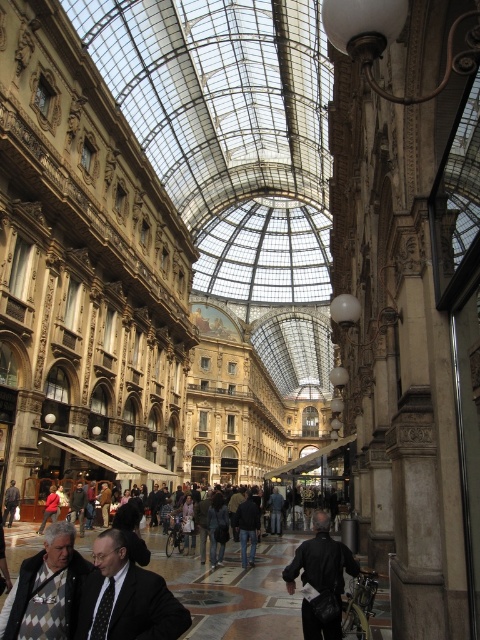
Can you confirm if dark gray suit at center is bigger than red matte jacket at lower left?

Yes, dark gray suit at center is bigger than red matte jacket at lower left.

At what (x,y) coordinates should I click in order to perform the action: click on dark gray suit at center. Please return your answer as a coordinate pair (x, y). Looking at the image, I should click on (126, 596).

Is knitted sweater at lower left to the right of dark gray jacket at center from the viewer's perspective?

Indeed, knitted sweater at lower left is positioned on the right side of dark gray jacket at center.

Between knitted sweater at lower left and dark gray jacket at center, which one is positioned higher?

knitted sweater at lower left is above.

Is point (54, 596) closer to camera compared to point (6, 513)?

Yes, point (54, 596) is closer to viewer.

Locate an element on the screen. knitted sweater at lower left is located at coordinates (47, 589).

Where is `dark gray jacket at center`? dark gray jacket at center is located at coordinates (11, 502).

Can you confirm if dark gray jacket at center is positioned to the right of red matte jacket at lower left?

In fact, dark gray jacket at center is to the left of red matte jacket at lower left.

Who is more distant from viewer, (3, 522) or (50, 486)?

The point (50, 486) is more distant.

Find the location of a particular element. Image resolution: width=480 pixels, height=640 pixels. dark gray jacket at center is located at coordinates (11, 502).